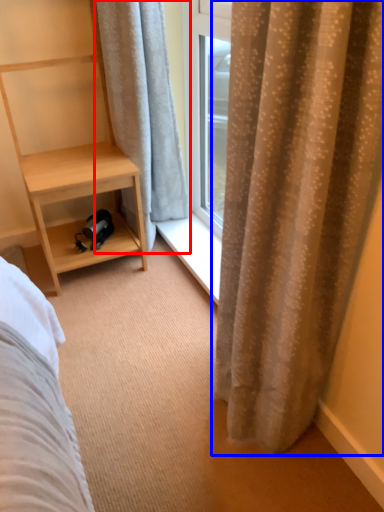
Question: Which object is further to the camera taking this photo, curtain (highlighted by a red box) or curtain (highlighted by a blue box)?

Choices:
 (A) curtain
 (B) curtain

Answer: (A)